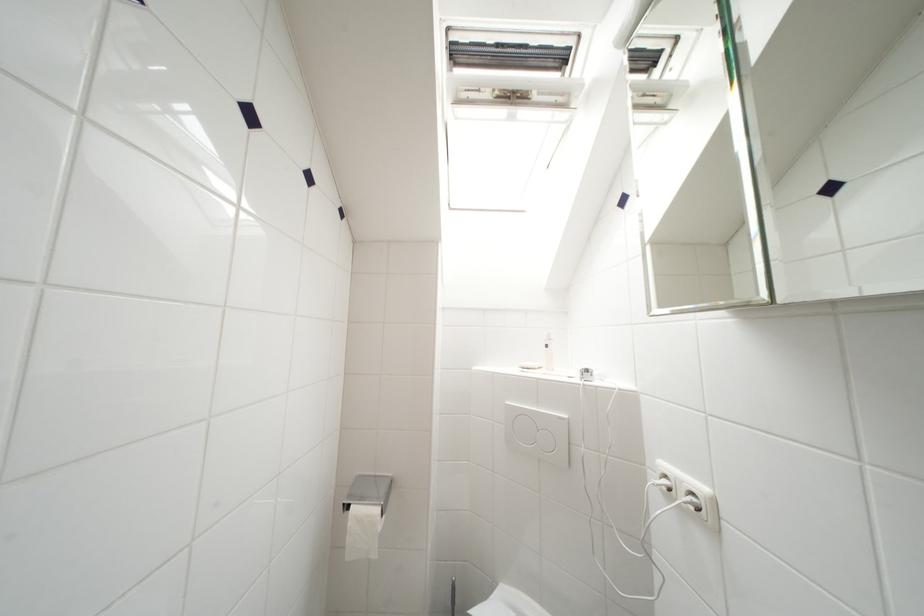
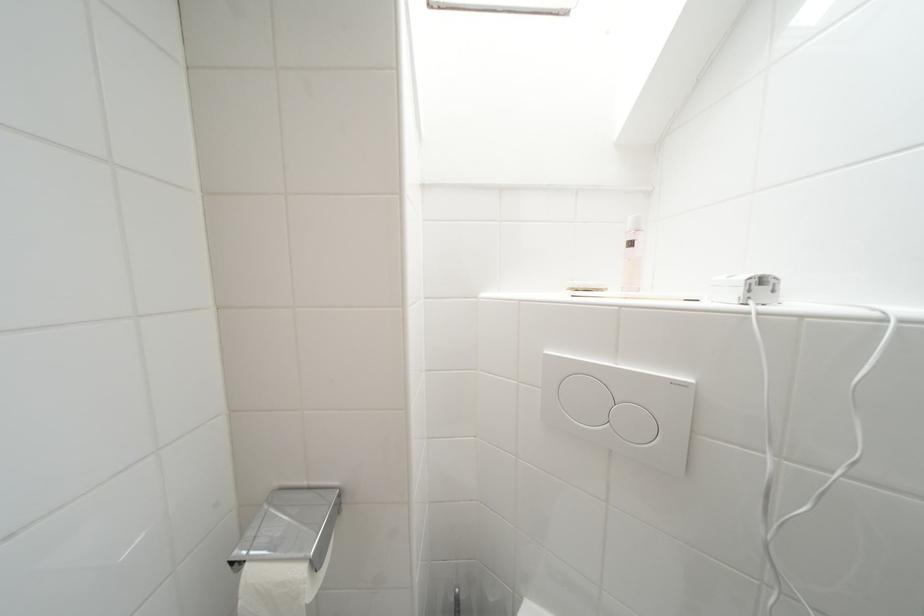
The point at (593, 374) is marked in the first image. Where is the corresponding point in the second image?

(769, 283)